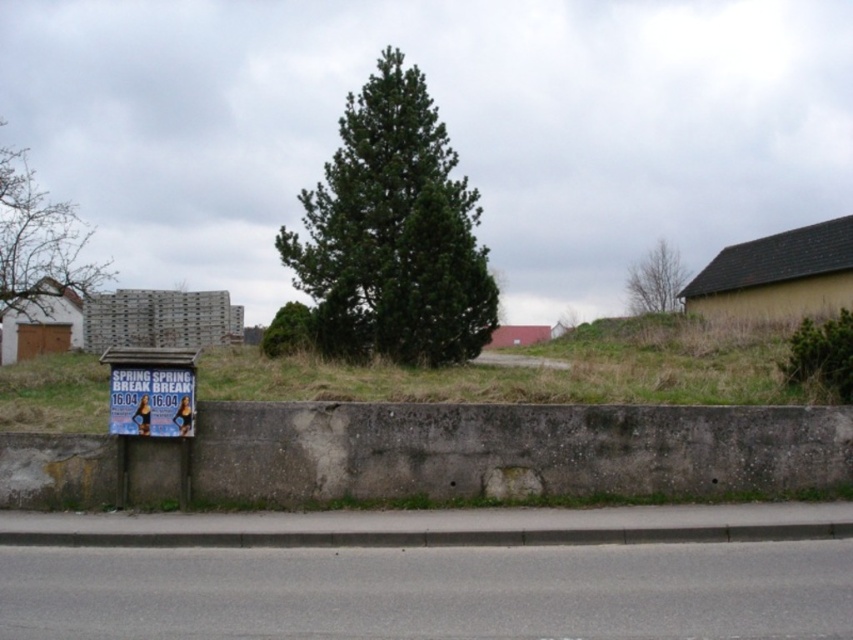
Question: Which object is closer to the camera taking this photo?

Choices:
 (A) green leafy tree at upper center
 (B) green matte tree at center

Answer: (B)

Question: Considering the real-world distances, which object is farthest from the green leafy tree at upper center?

Choices:
 (A) green matte tree at center
 (B) blue paper sign at lower left

Answer: (B)

Question: Which point appears closest to the camera in this image?

Choices:
 (A) (109, 372)
 (B) (415, 337)
 (C) (650, 307)
 (D) (207, 538)

Answer: (D)

Question: Can you confirm if gray concrete curb at lower center is bigger than blue paper sign at lower left?

Choices:
 (A) yes
 (B) no

Answer: (A)

Question: Does blue paper sign at lower left lie behind green leafy tree at upper center?

Choices:
 (A) no
 (B) yes

Answer: (A)

Question: Can you confirm if gray concrete curb at lower center is thinner than green leafy tree at upper center?

Choices:
 (A) yes
 (B) no

Answer: (B)